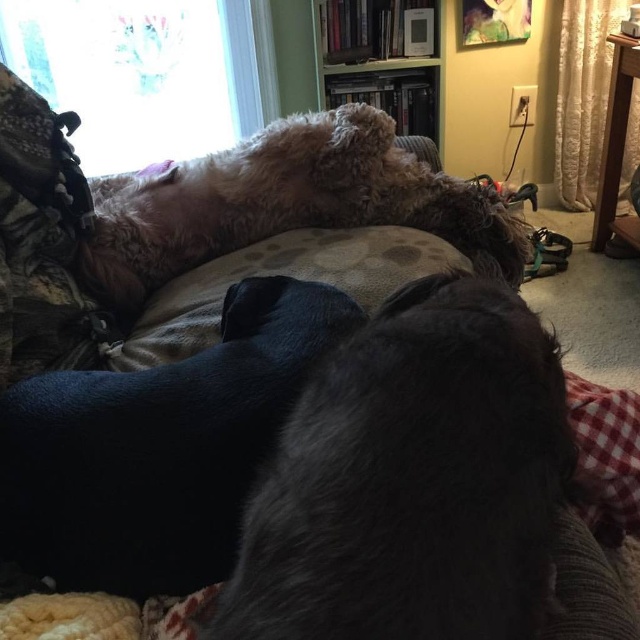
Which is more to the left, shiny black fur at center or fuzzy brown dog at upper center?

Positioned to the left is shiny black fur at center.

Where is `shiny black fur at center`? The image size is (640, 640). shiny black fur at center is located at coordinates (156, 449).

Looking at this image, is the position of shiny black fur at center more distant than that of clear glass window at upper left?

That is False.

Image resolution: width=640 pixels, height=640 pixels. I want to click on shiny black fur at center, so click(x=156, y=449).

Which is in front, point (216, 534) or point (202, 140)?

Point (216, 534) is more forward.

Where is `shiny black fur at center`? This screenshot has width=640, height=640. shiny black fur at center is located at coordinates (156, 449).

Between shiny black fur at center and wooden bookshelf at upper center, which one is positioned lower?

Positioned lower is shiny black fur at center.

Can you confirm if shiny black fur at center is smaller than wooden bookshelf at upper center?

Indeed, shiny black fur at center has a smaller size compared to wooden bookshelf at upper center.

Image resolution: width=640 pixels, height=640 pixels. I want to click on shiny black fur at center, so click(156, 449).

The image size is (640, 640). I want to click on shiny black fur at center, so click(x=156, y=449).